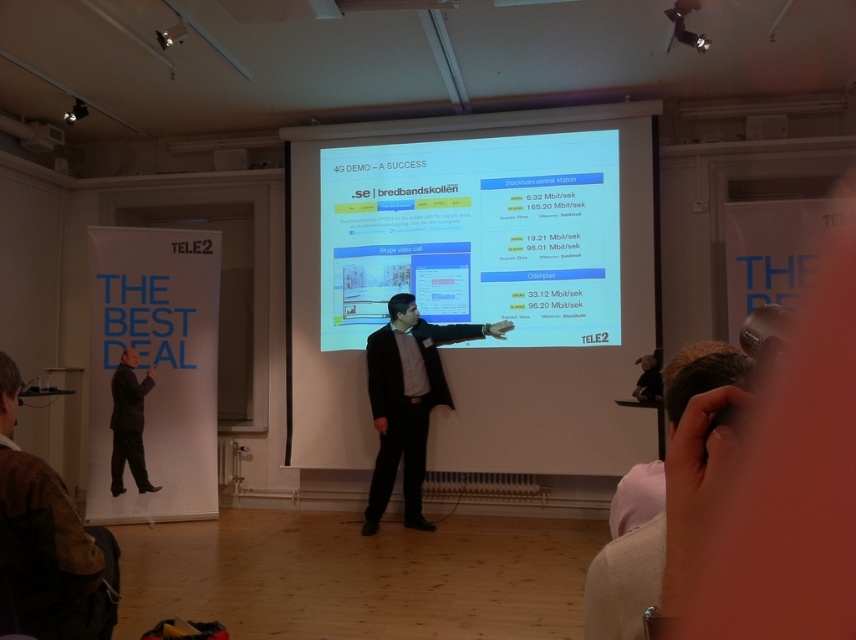
Does point (524, 145) lie in front of point (128, 369)?

No, (524, 145) is behind (128, 369).

Which of these two, matte white projector screen at center or dark suit at left, stands shorter?

dark suit at left is shorter.

Who is more forward, (435, 138) or (120, 416)?

Point (120, 416) is more forward.

The image size is (856, 640). Find the location of `matte white projector screen at center`. matte white projector screen at center is located at coordinates (479, 280).

Between matte white projector screen at center and white paperboard at left, which one has less height?

white paperboard at left

Is matte white projector screen at center positioned before white paperboard at left?

Yes, matte white projector screen at center is in front of white paperboard at left.

Where is `matte white projector screen at center`? matte white projector screen at center is located at coordinates (479, 280).

Image resolution: width=856 pixels, height=640 pixels. What are the coordinates of `matte white projector screen at center` in the screenshot? It's located at (479, 280).

Is matte white projector screen at center above black suit at center?

Correct, matte white projector screen at center is located above black suit at center.

Is point (440, 321) less distant than point (431, 324)?

No.

Does point (450, 413) come behind point (408, 465)?

Yes, it is.

In order to click on matte white projector screen at center in this screenshot , I will do `click(479, 280)`.